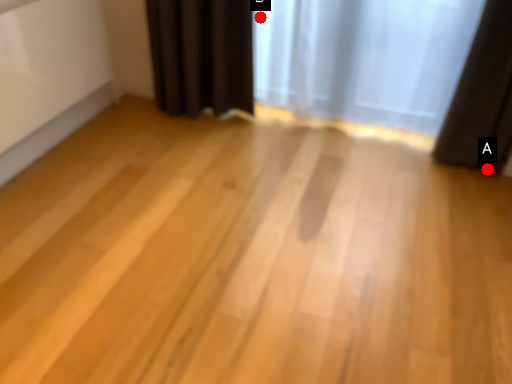
Question: Two points are circled on the image, labeled by A and B beside each circle. Which point is closer to the camera?

Choices:
 (A) A is closer
 (B) B is closer

Answer: (A)